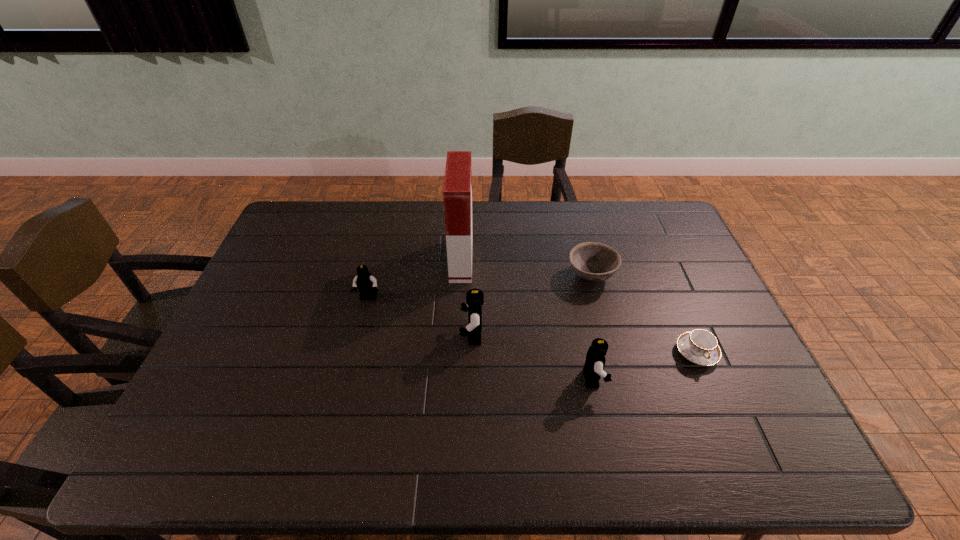
You are a GUI agent. You are given a task and a screenshot of the screen. Output one action in this format:
    pyautogui.click(x=<x>, y=<y>)
    Task: Click on the free region located 0.070m on the front-facing side of the second Lego from left to right
    The image size is (960, 540).
    Given the screenshot: What is the action you would take?
    pyautogui.click(x=435, y=335)

Locate an element on the screen. vacant area situated on the front-facing side of the second Lego from left to right is located at coordinates (334, 335).

Find the location of a particular element. free space located on the front-facing side of the second Lego from left to right is located at coordinates click(x=356, y=335).

I want to click on vacant area located 0.250m on the front-facing side of the second shortest Lego, so click(x=702, y=379).

The image size is (960, 540). What are the coordinates of `vacant space located 0.390m on the front-facing side of the tallest object` in the screenshot? It's located at (590, 260).

Where is `vacant space situated on the side with the handle of the rightmost object`? The height and width of the screenshot is (540, 960). vacant space situated on the side with the handle of the rightmost object is located at coordinates (726, 420).

Locate an element on the screen. This screenshot has width=960, height=540. free location located on the left of the bowl is located at coordinates (488, 275).

Find the location of `object located in the far edge section of the desktop`. object located in the far edge section of the desktop is located at coordinates (457, 191).

At what (x,y) coordinates should I click in order to perform the action: click on object that is positioned at the near edge. Please return your answer as a coordinate pair (x, y). Looking at the image, I should click on (593, 368).

You are a GUI agent. You are given a task and a screenshot of the screen. Output one action in this format:
    pyautogui.click(x=<x>, y=<y>)
    Task: Click on the object situated at the right edge
    Image resolution: width=960 pixels, height=540 pixels.
    Given the screenshot: What is the action you would take?
    pyautogui.click(x=701, y=347)